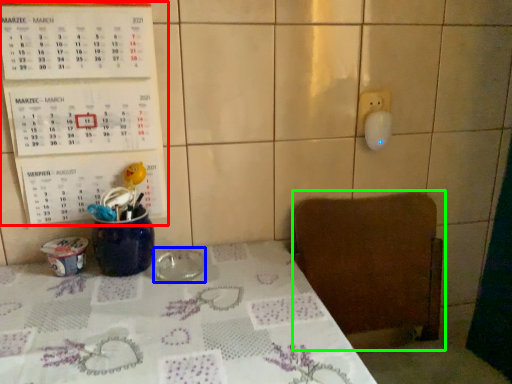
Question: Estimate the real-world distances between objects in this image. Which object is closer to bulletin board (highlighted by a red box), tableware (highlighted by a blue box) or chair (highlighted by a green box)?

Choices:
 (A) tableware
 (B) chair

Answer: (A)